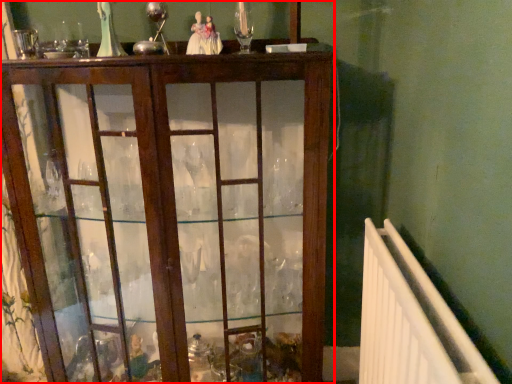
Question: From the image's perspective, where is furniture (annotated by the red box) located relative to radiator?

Choices:
 (A) above
 (B) below

Answer: (A)